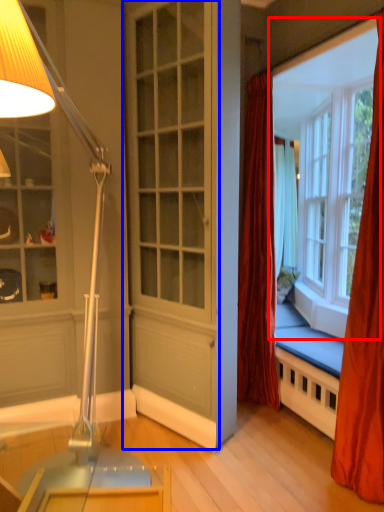
Question: Among these objects, which one is nearest to the camera, window (highlighted by a red box) or screen door (highlighted by a blue box)?

Choices:
 (A) window
 (B) screen door

Answer: (B)